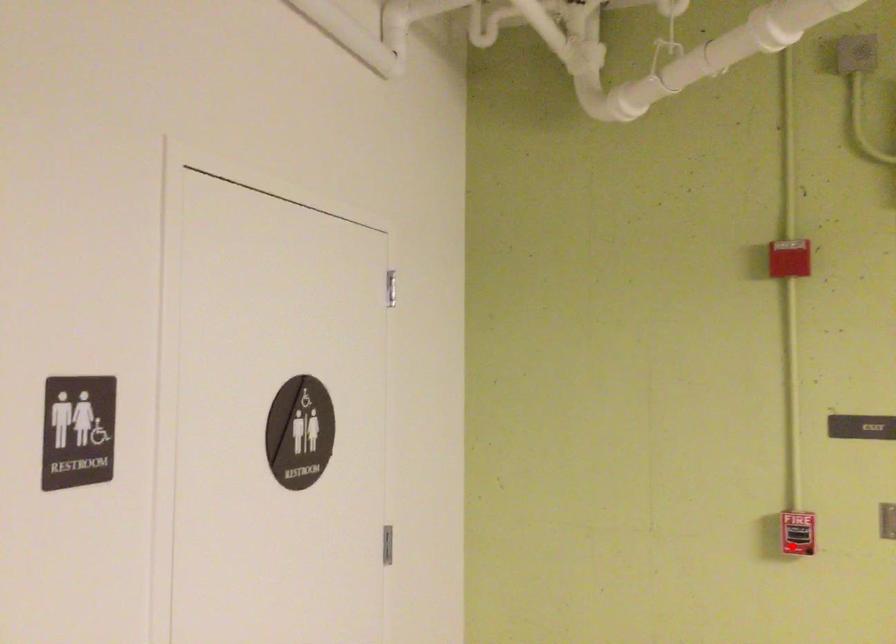
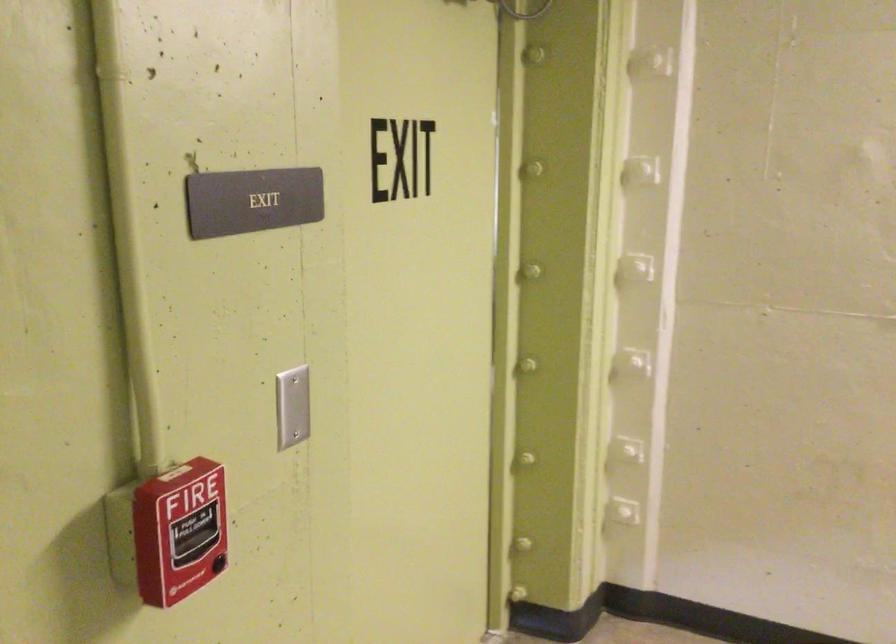
Question: I am providing you with two images of the same scene from different viewpoints. Image1 has a red point marked. In image2, the corresponding 3D location appears at what relative position? Reply with the corresponding letter.

Choices:
 (A) Closer
 (B) Farther

Answer: (A)